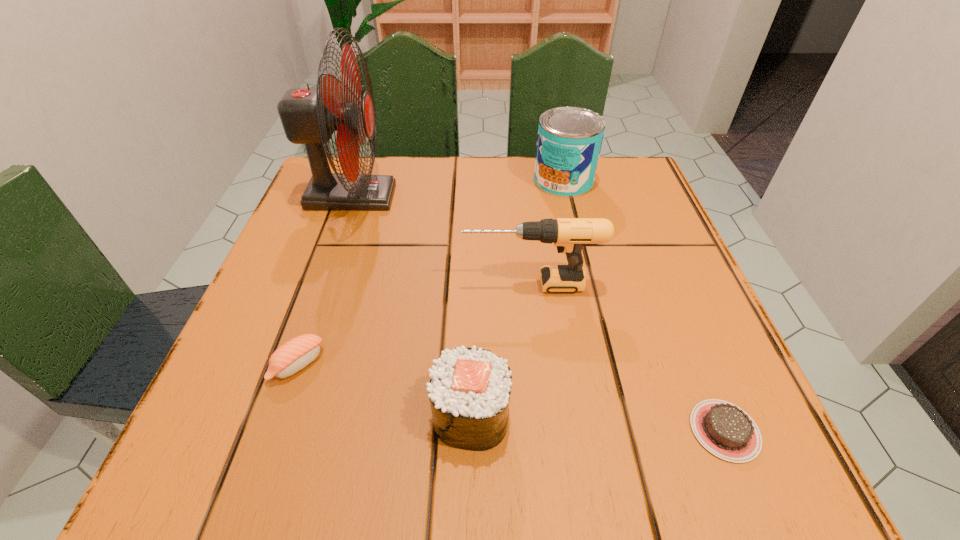
In order to click on vacant space at the left edge of the desktop in this screenshot , I will do `click(342, 303)`.

At what (x,y) coordinates should I click in order to perform the action: click on blank space at the right edge of the desktop. Please return your answer as a coordinate pair (x, y). The height and width of the screenshot is (540, 960). Looking at the image, I should click on (671, 372).

Image resolution: width=960 pixels, height=540 pixels. Find the location of `free region at the far left corner of the desktop`. free region at the far left corner of the desktop is located at coordinates (335, 166).

You are a GUI agent. You are given a task and a screenshot of the screen. Output one action in this format:
    pyautogui.click(x=<x>, y=<y>)
    Task: Click on the vacant space at the far right corner of the desktop
    
    Given the screenshot: What is the action you would take?
    point(647,180)

This screenshot has width=960, height=540. Find the location of `blank space at the near right corner`. blank space at the near right corner is located at coordinates (655, 470).

This screenshot has width=960, height=540. Identify the location of vacant space in between the can and the third shortest object. (516, 298).

Where is `empty space between the tallest object and the rightmost object`? This screenshot has width=960, height=540. empty space between the tallest object and the rightmost object is located at coordinates (538, 314).

This screenshot has width=960, height=540. Identify the location of empty space between the tallest object and the rightmost object. (538, 314).

The height and width of the screenshot is (540, 960). I want to click on free space that is in between the can and the rightmost object, so point(644,306).

This screenshot has height=540, width=960. I want to click on free space between the tallest object and the fourth tallest object, so click(x=411, y=306).